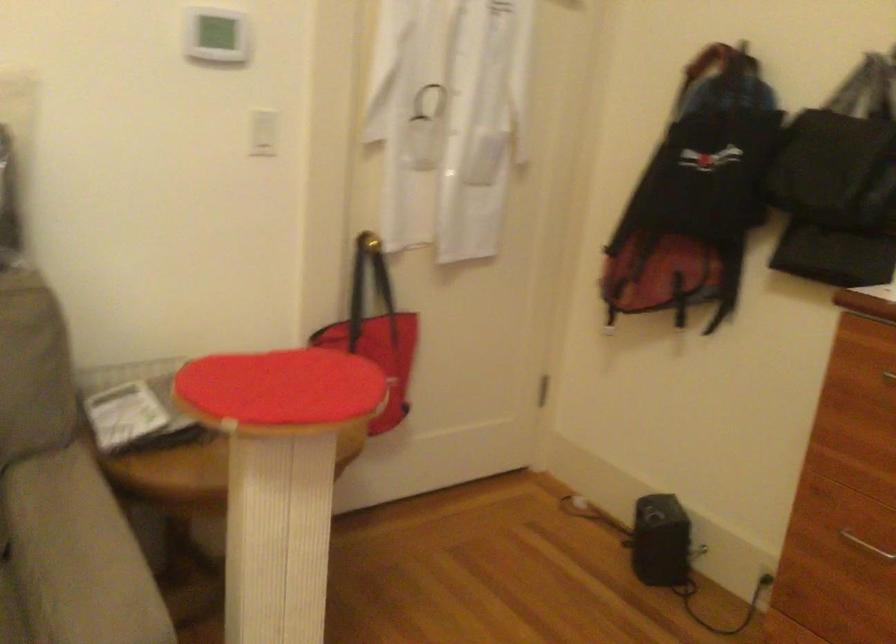
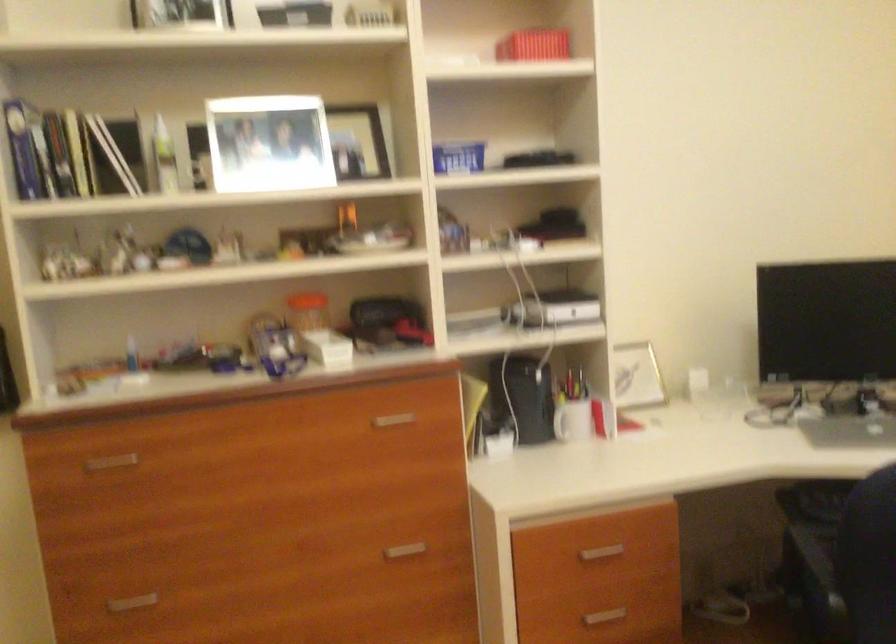
Question: The images are taken continuously from a first-person perspective. In which direction is your viewpoint rotating?

Choices:
 (A) Left
 (B) Right
 (C) Up
 (D) Down

Answer: (B)